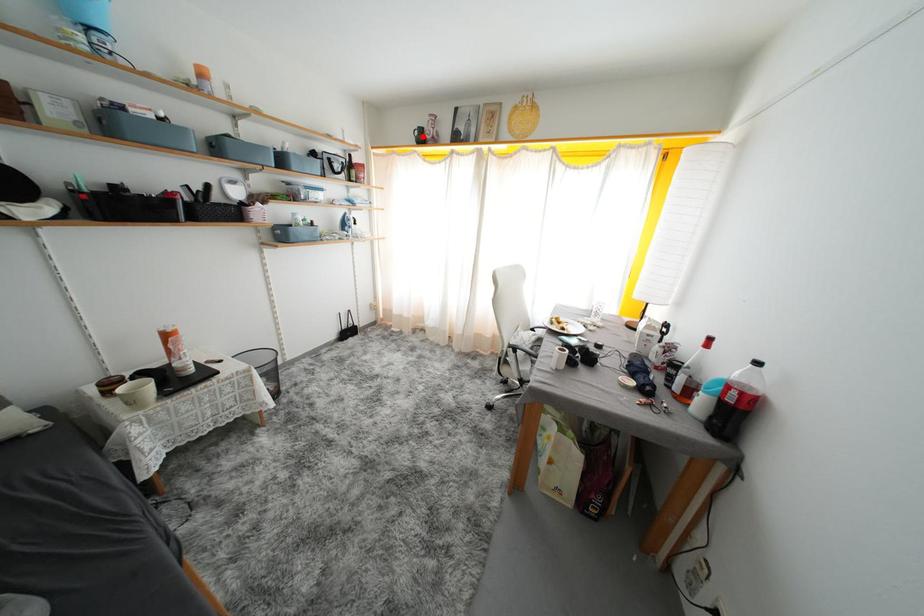
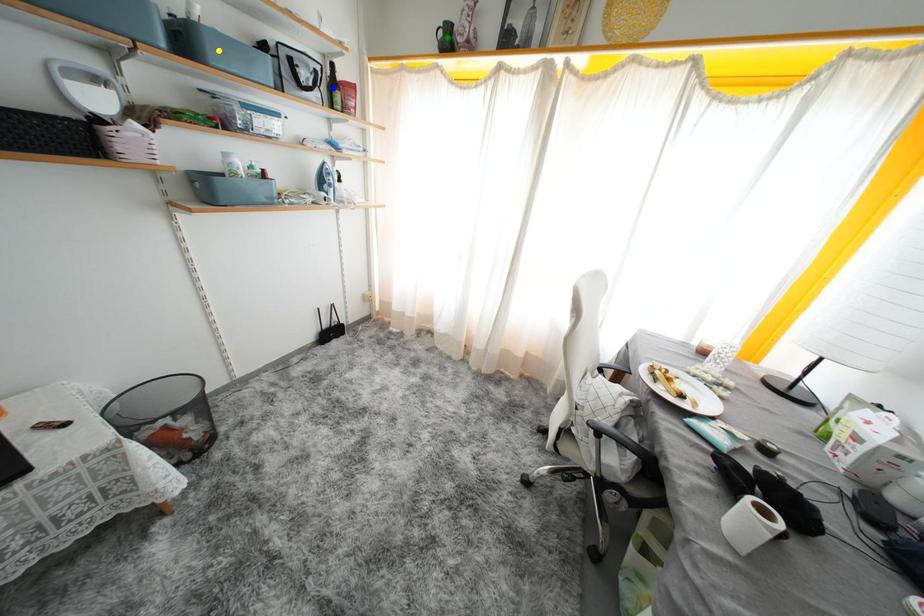
Question: I am providing you with two images of the same scene from different viewpoints. A red point is marked on the first image. You are given multiple points on the second image. In image 2, which mark is for the same physical point as the one in image 1?

Choices:
 (A) green point
 (B) blue point
 (C) yellow point

Answer: (A)